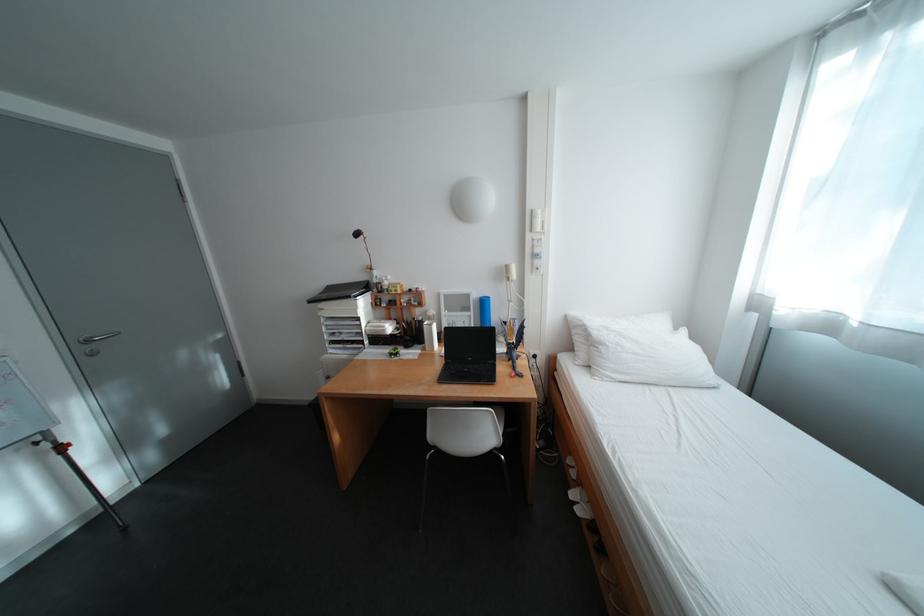
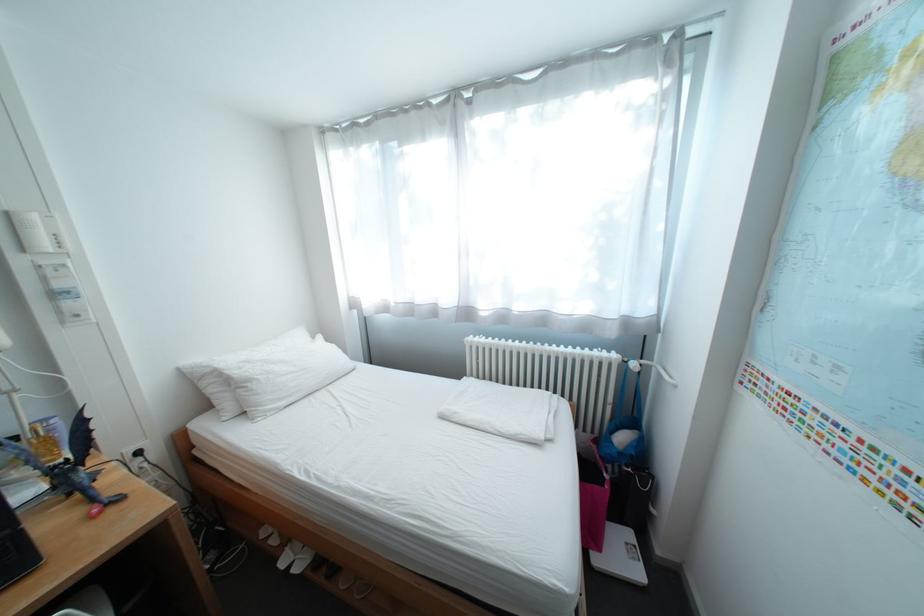
Find the pixel in the second image that matches the point at 614,346 in the first image.

(263, 383)